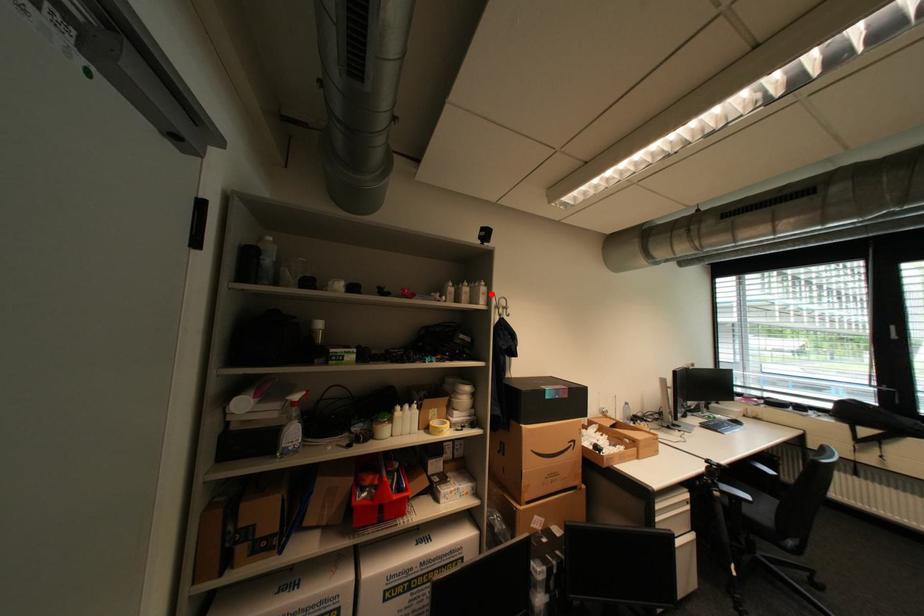
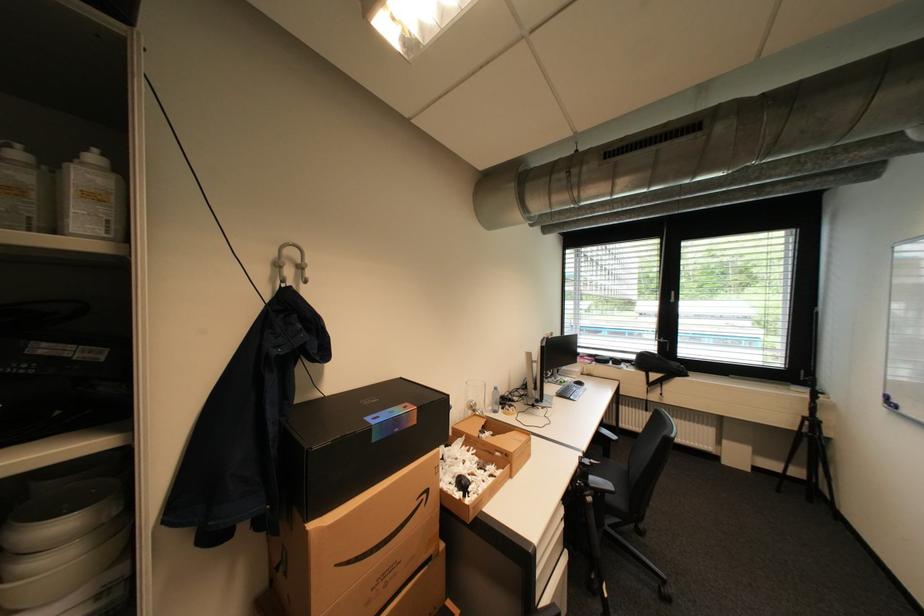
The point at the highlighted location is marked in the first image. Where is the corresponding point in the second image?

(100, 197)